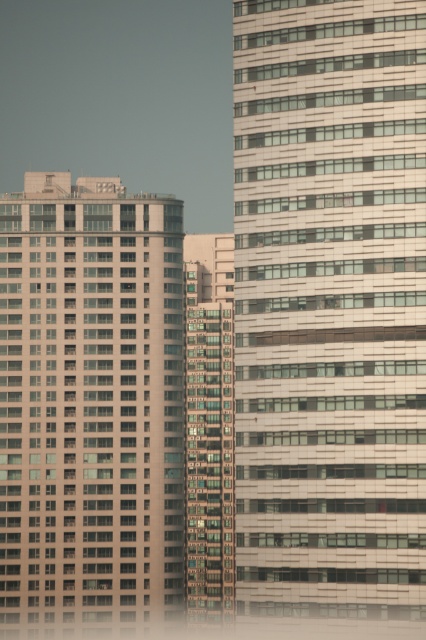
Question: Is white glass building at center to the left of glassy reflective windows at center from the viewer's perspective?

Choices:
 (A) yes
 (B) no

Answer: (B)

Question: Does white glass building at center have a larger size compared to glassy reflective windows at center?

Choices:
 (A) yes
 (B) no

Answer: (A)

Question: Observing the image, what is the correct spatial positioning of matte glass building at left in reference to glassy reflective windows at center?

Choices:
 (A) below
 (B) above

Answer: (A)

Question: Which point is closer to the camera?

Choices:
 (A) matte glass building at left
 (B) white glass building at center
 (C) glassy reflective windows at center

Answer: (B)

Question: Considering the real-world distances, which object is closest to the matte glass building at left?

Choices:
 (A) white glass building at center
 (B) glassy reflective windows at center

Answer: (B)

Question: Among these objects, which one is farthest from the camera?

Choices:
 (A) white glass building at center
 (B) glassy reflective windows at center

Answer: (B)